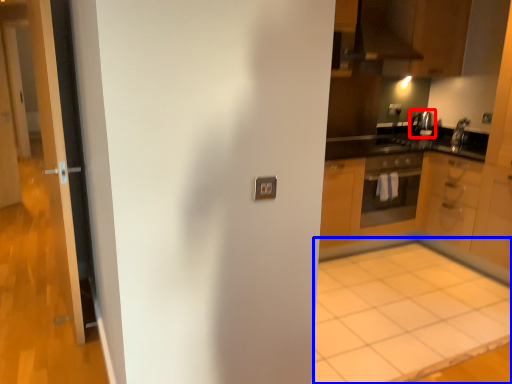
Question: Which of the following is the closest to the observer, appliance (highlighted by a red box) or plain (highlighted by a blue box)?

Choices:
 (A) appliance
 (B) plain

Answer: (B)